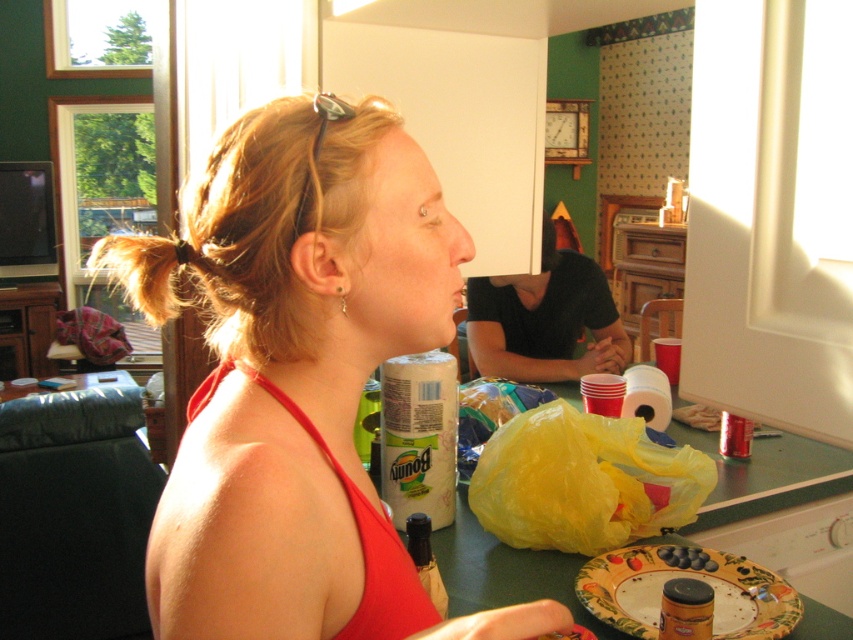
You are organizing a picnic and need to pack the items from the counter. The matte red bikini top at center and the white paper towel at center are both on the counter. Which item should you pick up first if you want to reach the one below first?

The white paper towel at center should be picked up first because the matte red bikini top at center is above it, so you need to remove the top item first to access the one below.

You are organizing a beach day and need to pack items from the kitchen counter. You have a matte red bikini top at center and a white paper towel at center. Which item takes up more space on the counter?

The matte red bikini top at center is larger in size than the white paper towel at center, so it takes up more space on the counter.